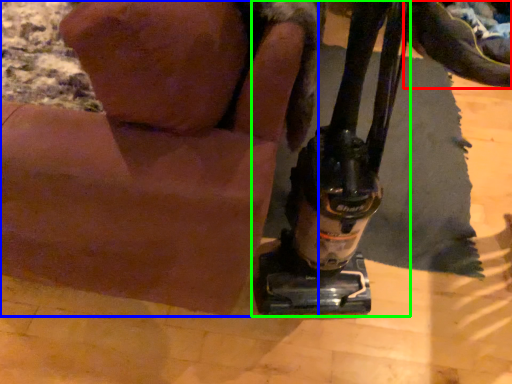
Question: Based on their relative distances, which object is farther from footwear (highlighted by a red box)? Choose from animal (highlighted by a blue box) and sewing machine (highlighted by a green box).

Choices:
 (A) animal
 (B) sewing machine

Answer: (A)